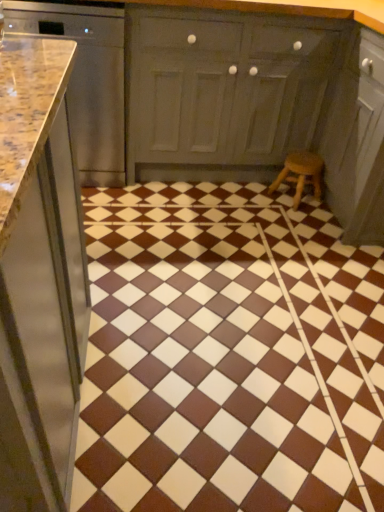
Question: Is brown glossy tile at center beside matte gray cabinet at center, marked as the first cabinetry in a right-to-left arrangement?

Choices:
 (A) yes
 (B) no

Answer: (B)

Question: Is brown glossy tile at center taller than matte gray cabinet at center, placed as the second cabinetry when sorted from left to right?

Choices:
 (A) no
 (B) yes

Answer: (A)

Question: Is brown glossy tile at center outside of matte gray cabinet at center, placed as the second cabinetry when sorted from left to right?

Choices:
 (A) no
 (B) yes

Answer: (B)

Question: Is brown glossy tile at center facing away from matte gray cabinet at center, placed as the second cabinetry when sorted from left to right?

Choices:
 (A) yes
 (B) no

Answer: (B)

Question: Is brown glossy tile at center closer to camera compared to matte gray cabinet at center, placed as the second cabinetry when sorted from left to right?

Choices:
 (A) no
 (B) yes

Answer: (B)

Question: Relative to polished granite countertop at left, acting as the first cabinetry starting from the left, is brown glossy tile at center in front or behind?

Choices:
 (A) front
 (B) behind

Answer: (A)

Question: In terms of height, does brown glossy tile at center look taller or shorter compared to polished granite countertop at left, arranged as the 2th cabinetry when viewed from the right?

Choices:
 (A) tall
 (B) short

Answer: (B)

Question: In terms of width, does brown glossy tile at center look wider or thinner when compared to polished granite countertop at left, arranged as the 2th cabinetry when viewed from the right?

Choices:
 (A) wide
 (B) thin

Answer: (A)

Question: Would you say brown glossy tile at center is to the left or to the right of polished granite countertop at left, acting as the first cabinetry starting from the left, in the picture?

Choices:
 (A) right
 (B) left

Answer: (A)

Question: Based on their sizes in the image, would you say brown glossy tile at center is bigger or smaller than matte gray cabinet at center, placed as the second cabinetry when sorted from left to right?

Choices:
 (A) small
 (B) big

Answer: (A)

Question: Is brown glossy tile at center inside or outside of matte gray cabinet at center, placed as the second cabinetry when sorted from left to right?

Choices:
 (A) outside
 (B) inside

Answer: (A)

Question: Does point (125, 309) appear closer or farther from the camera than point (162, 52)?

Choices:
 (A) closer
 (B) farther

Answer: (A)

Question: From the image's perspective, is brown glossy tile at center above or below matte gray cabinet at center, marked as the first cabinetry in a right-to-left arrangement?

Choices:
 (A) above
 (B) below

Answer: (B)

Question: Is wooden stool at lower right in front of or behind brown glossy tile at center in the image?

Choices:
 (A) front
 (B) behind

Answer: (B)

Question: Considering the relative positions of wooden stool at lower right and brown glossy tile at center in the image provided, is wooden stool at lower right to the left or to the right of brown glossy tile at center?

Choices:
 (A) left
 (B) right

Answer: (B)